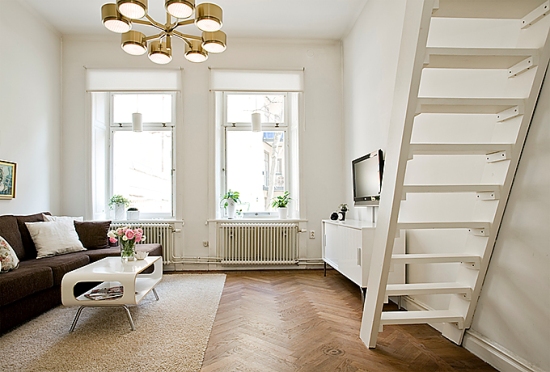
Locate an element on the screen. This screenshot has width=550, height=372. television is located at coordinates (361, 164).